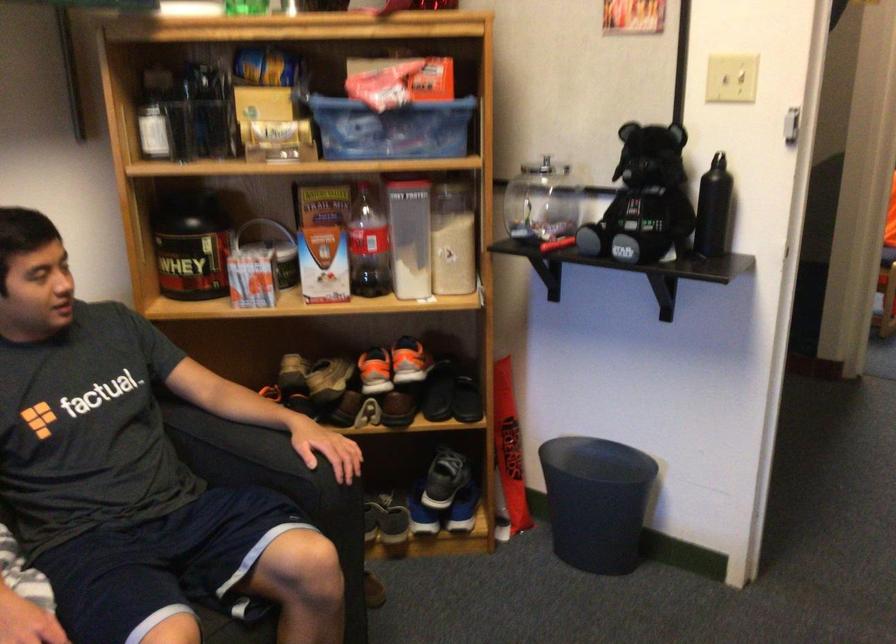
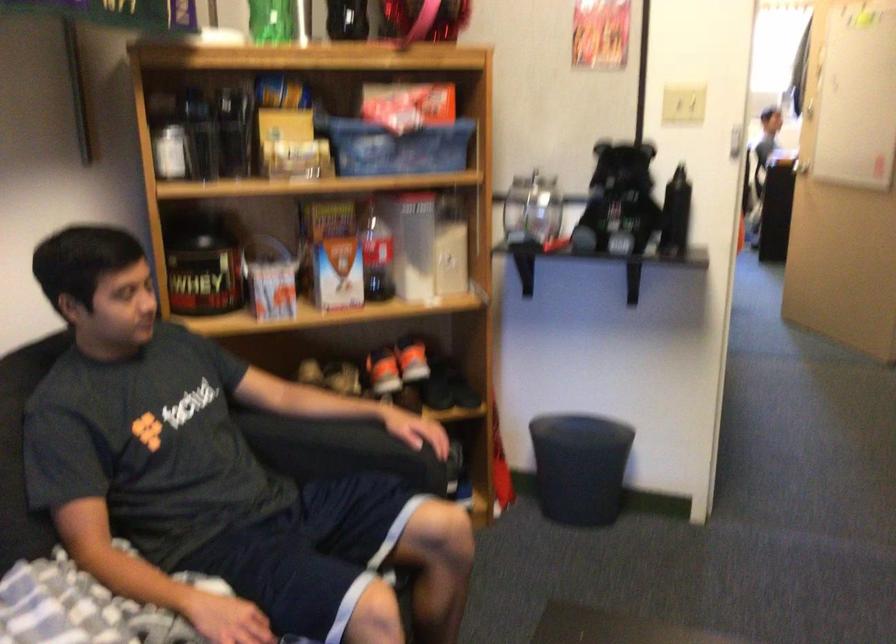
Question: The camera is either moving clockwise (left) or counter-clockwise (right) around the object. The first image is from the beginning of the video and the second image is from the end. Is the camera moving left or right when shooting the video?

Choices:
 (A) Left
 (B) Right

Answer: (A)